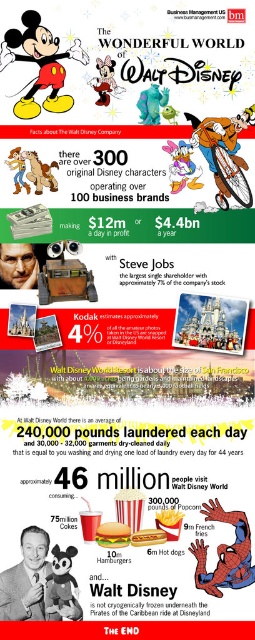
You are looking at the infographic and want to touch both the matte red shorts at center and the pastel pink paper at center. Which object would your hand reach first if you extend it straight ahead?

The matte red shorts at center is closer to the viewer than the pastel pink paper at center, so your hand would reach the matte red shorts at center first.

You are designing a layout for a poster and have placed both the matte red shorts at center and the pastel pink paper at center. Based on their sizes, which object would you need to adjust if you want both to fit within a standard 8.5x11 inch frame without overlapping?

The matte red shorts at center has a larger width than the pastel pink paper at center, so you would need to adjust the size of the matte red shorts at center to ensure both fit within the frame without overlapping.